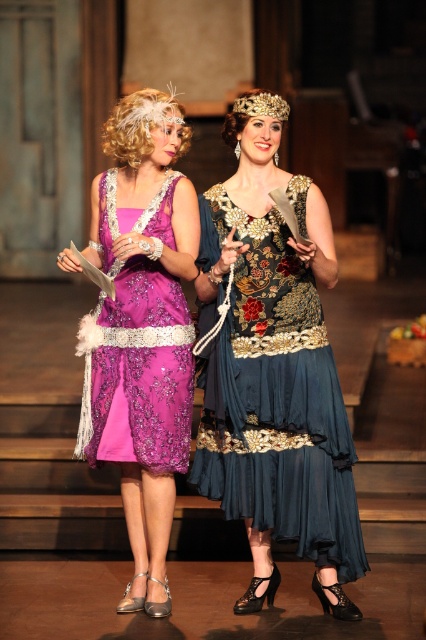
Question: Does velvet blue dress at center appear on the left side of matte purple dress at center?

Choices:
 (A) no
 (B) yes

Answer: (A)

Question: Which is farther from the velvet blue dress at center?

Choices:
 (A) matte purple dress at center
 (B) purple satin dress at center

Answer: (A)

Question: Which point is farther from the camera taking this photo?

Choices:
 (A) (143, 429)
 (B) (167, 420)

Answer: (B)

Question: Can you confirm if velvet blue dress at center is positioned to the left of purple satin dress at center?

Choices:
 (A) no
 (B) yes

Answer: (A)

Question: Observing the image, what is the correct spatial positioning of matte purple dress at center in reference to purple satin dress at center?

Choices:
 (A) below
 (B) above

Answer: (A)

Question: Which point is farther to the camera?

Choices:
 (A) (98, 410)
 (B) (247, 321)

Answer: (A)